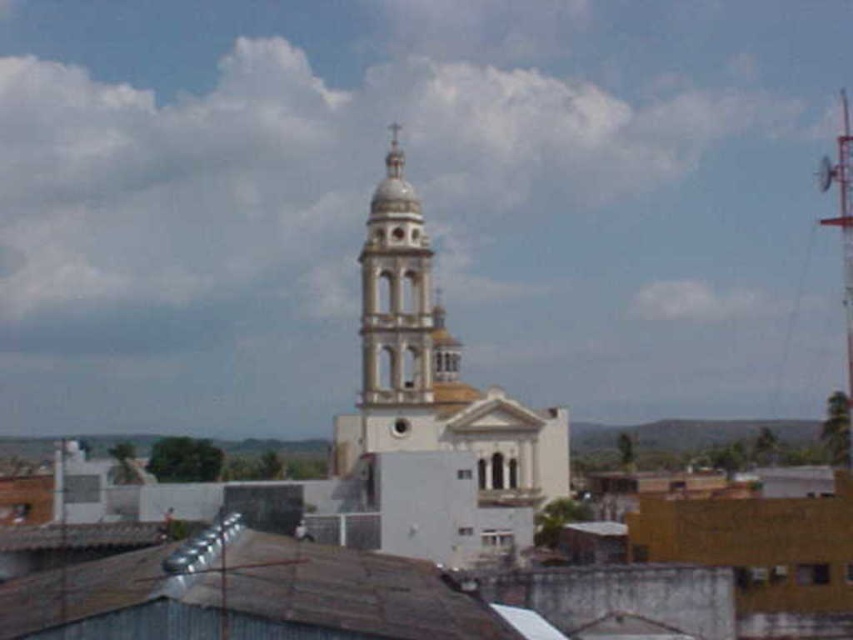
Question: Does white stone church at center appear over white stone bell tower at center?

Choices:
 (A) no
 (B) yes

Answer: (B)

Question: Which object appears farthest from the camera in this image?

Choices:
 (A) white stone bell tower at center
 (B) white stone church at center

Answer: (A)

Question: Which point is closer to the camera?

Choices:
 (A) click(x=366, y=440)
 (B) click(x=370, y=202)

Answer: (A)

Question: Can you confirm if white stone church at center is positioned above white stone bell tower at center?

Choices:
 (A) no
 (B) yes

Answer: (B)

Question: Does white stone church at center appear over white stone bell tower at center?

Choices:
 (A) no
 (B) yes

Answer: (B)